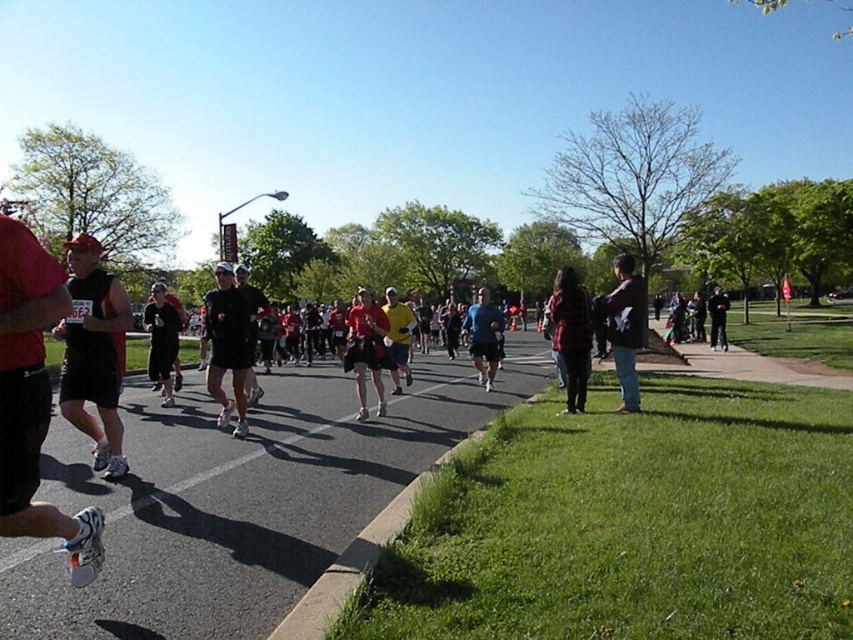
You are a photographer at the marathon event. You need to capture a photo of the runners while ensuring their clothing details are visible. Which runner should you focus on to get a clearer image of their clothing details, the matte black tank top at left or the blue fabric shirt at center?

The matte black tank top at left is thinner than the blue fabric shirt at center, so focusing on the blue fabric shirt at center will provide a clearer image of clothing details because thicker fabrics generally offer more texture and contrast for photography.

You are a spectator standing at the starting line of the marathon. You see the matte black tank top at left and the blue fabric shirt at center. Which runner is closer to the ground?

The matte black tank top at left is positioned under the blue fabric shirt at center, so the runner wearing the matte black tank top at left is closer to the ground.

You are a photographer positioned at the starting line of the marathon. You want to take a photo that includes both the dark brown leather jacket at right and the dark gray fabric jacket at center. Which jacket will appear larger in the photo?

The dark brown leather jacket at right will appear larger in the photo because it is closer to the viewer than the dark gray fabric jacket at center.